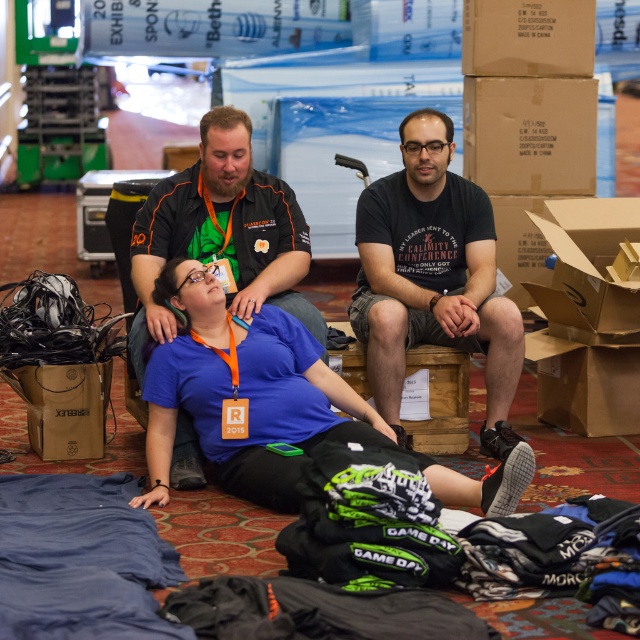
Consider the image. You are a convention attendee carrying a 2.5 meter long banner. You need to place it between the brown paper bag at lower left and the wooden crate at center. Is there enough space to lay it flat without folding?

The distance between the brown paper bag at lower left and the wooden crate at center is 2.79 meters. Since the banner is 2.5 meters long, there is sufficient space to lay it flat without folding.